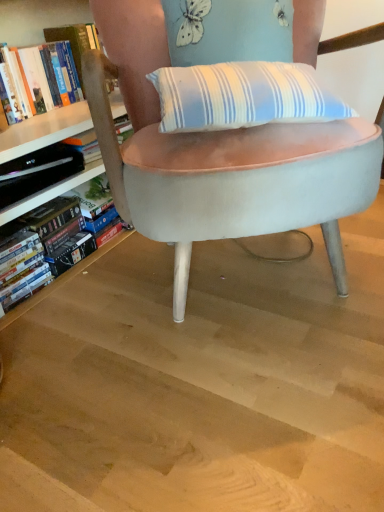
What is the approximate width of light brown wood at center?

3.74 feet.

What do you see at coordinates (218, 158) in the screenshot? I see `velvet light blue chair at center` at bounding box center [218, 158].

Describe the element at coordinates (47, 71) in the screenshot. Image resolution: width=384 pixels, height=512 pixels. I see `hardcover book at left, which is the 1th book in top-to-bottom order` at that location.

Find the location of a particular element. light brown wood at center is located at coordinates (199, 382).

Which is in front, point (7, 97) or point (67, 160)?

The point (7, 97) is in front.

Can hardcover book at left be found inside hardcover book at left, which appears as the 2th book when ordered from the bottom?

No, hardcover book at left is not inside hardcover book at left, which appears as the 2th book when ordered from the bottom.

Is hardcover book at left, which appears as the 2th book when ordered from the bottom, oriented towards hardcover book at left?

No, hardcover book at left, which appears as the 2th book when ordered from the bottom, is not turned towards hardcover book at left.

Does hardcover book at left, which is the 1th book in top-to-bottom order, have a greater height compared to hardcover book at left?

Yes, hardcover book at left, which is the 1th book in top-to-bottom order, is taller than hardcover book at left.

Does hardcover book at left, the 2th book from the top, lie behind hardcover book at left, which is the 1th book in top-to-bottom order?

No, the depth of hardcover book at left, the 2th book from the top, is less than that of hardcover book at left, which is the 1th book in top-to-bottom order.

From the image's perspective, is hardcover book at left, the 2th book from the top, located above or below hardcover book at left, which is the 1th book in top-to-bottom order?

Based on their image positions, hardcover book at left, the 2th book from the top, is located beneath hardcover book at left, which is the 1th book in top-to-bottom order.

Is hardcover book at left, which is the 1th book in top-to-bottom order, a part of hardcover book at left, the 2th book from the top?

No.

Can you confirm if hardcover book at left, the 1th book positioned from the bottom, is smaller than hardcover book at left, which is the 1th book in top-to-bottom order?

No, hardcover book at left, the 1th book positioned from the bottom, is not smaller than hardcover book at left, which is the 1th book in top-to-bottom order.

From a real-world perspective, does hardcover book at left sit lower than hardcover book at left, the 2th book from the top?

No, from a real-world perspective, hardcover book at left is not under hardcover book at left, the 2th book from the top.

Which of these two, hardcover book at left or hardcover book at left, the 1th book positioned from the bottom, is smaller?

hardcover book at left is smaller.

Is hardcover book at left wider than hardcover book at left, the 1th book positioned from the bottom?

Yes.

Who is shorter, velvet light blue chair at center or light brown wood at center?

light brown wood at center is shorter.

Measure the distance between velvet light blue chair at center and light brown wood at center.

velvet light blue chair at center is 12.72 inches away from light brown wood at center.

Does point (272, 191) come in front of point (216, 433)?

That is False.

Does point (53, 508) lie behind point (85, 256)?

That is False.

Visually, is light brown wood at center positioned to the left or to the right of hardcover book at left, the 2th book from the top?

Based on their positions, light brown wood at center is located to the right of hardcover book at left, the 2th book from the top.

Consider the image. Based on their sizes in the image, would you say light brown wood at center is bigger or smaller than hardcover book at left, the 2th book from the top?

In the image, light brown wood at center appears to be larger than hardcover book at left, the 2th book from the top.

Measure the distance between light brown wood at center and hardcover book at left, the 1th book positioned from the bottom.

16.89 inches.

Is velvet light blue chair at center aimed at hardcover book at left?

No.

From the image's perspective, which one is positioned lower, velvet light blue chair at center or hardcover book at left?

hardcover book at left is shown below in the image.

How many degrees apart are the facing directions of velvet light blue chair at center and hardcover book at left?

There is a 51.2-degree angle between the facing directions of velvet light blue chair at center and hardcover book at left.

From a real-world perspective, between velvet light blue chair at center and hardcover book at left, who is vertically lower?

From a 3D spatial view, hardcover book at left is below.

From the image's perspective, is hardcover book at left positioned above or below hardcover book at left, which appears as the 2th book when ordered from the bottom?

hardcover book at left is situated lower than hardcover book at left, which appears as the 2th book when ordered from the bottom, in the image.

How many degrees apart are the facing directions of hardcover book at left and hardcover book at left, which is the 1th book in top-to-bottom order?

0.638 degrees separate the facing orientations of hardcover book at left and hardcover book at left, which is the 1th book in top-to-bottom order.

Between hardcover book at left and hardcover book at left, which is the 1th book in top-to-bottom order, which one has less height?

Standing shorter between the two is hardcover book at left.

In the image, is hardcover book at left positioned in front of or behind hardcover book at left, which is the 1th book in top-to-bottom order?

hardcover book at left is positioned closer to the viewer than hardcover book at left, which is the 1th book in top-to-bottom order.

This screenshot has height=512, width=384. I want to click on paperback book that appears below the hardcover book at left, which appears as the 2th book when ordered from the bottom (from a real-world perspective), so click(38, 172).

I want to click on book that is below the hardcover book at left, which is the 1th book in top-to-bottom order (from the image's perspective), so click(x=74, y=227).

In the scene shown: Which object lies nearer to the anchor point light brown wood at center, hardcover book at left, the 2th book from the top, or velvet light blue chair at center?

velvet light blue chair at center.

Which object lies further to the anchor point light brown wood at center, hardcover book at left or hardcover book at left, which is the 1th book in top-to-bottom order?

hardcover book at left, which is the 1th book in top-to-bottom order.

Looking at the image, which one is located further to light brown wood at center, hardcover book at left or hardcover book at left, the 1th book positioned from the bottom?

The object further to light brown wood at center is hardcover book at left.

Considering their positions, is velvet light blue chair at center positioned closer to light brown wood at center than hardcover book at left?

velvet light blue chair at center is closer to light brown wood at center.

In the scene shown: Looking at the image, which one is located further to hardcover book at left, hardcover book at left, which appears as the 2th book when ordered from the bottom, or hardcover book at left, the 2th book from the top?

hardcover book at left, which appears as the 2th book when ordered from the bottom, is further to hardcover book at left.

When comparing their distances from hardcover book at left, the 1th book positioned from the bottom, does light brown wood at center or velvet light blue chair at center seem closer?

light brown wood at center is positioned closer to the anchor hardcover book at left, the 1th book positioned from the bottom.

Which object lies nearer to the anchor point hardcover book at left, the 2th book from the top, hardcover book at left, which appears as the 2th book when ordered from the bottom, or velvet light blue chair at center?

hardcover book at left, which appears as the 2th book when ordered from the bottom, is closer to hardcover book at left, the 2th book from the top.

Considering their positions, is light brown wood at center positioned closer to hardcover book at left, which appears as the 2th book when ordered from the bottom, than hardcover book at left?

Among the two, hardcover book at left is located nearer to hardcover book at left, which appears as the 2th book when ordered from the bottom.

Identify the location of book between light brown wood at center and hardcover book at left, which is the 1th book in top-to-bottom order, along the z-axis. (74, 227).

At what (x,y) coordinates should I click in order to perform the action: click on paperback book between hardcover book at left, which is the 1th book in top-to-bottom order, and hardcover book at left, the 1th book positioned from the bottom, in the up-down direction. Please return your answer as a coordinate pair (x, y). The image size is (384, 512). Looking at the image, I should click on (38, 172).

Find the location of a particular element. paperback book between light brown wood at center and hardcover book at left, which is the 1th book in top-to-bottom order, from front to back is located at coordinates (38, 172).

Where is `book between hardcover book at left, which is the 1th book in top-to-bottom order, and velvet light blue chair at center from left to right`? book between hardcover book at left, which is the 1th book in top-to-bottom order, and velvet light blue chair at center from left to right is located at coordinates (74, 227).